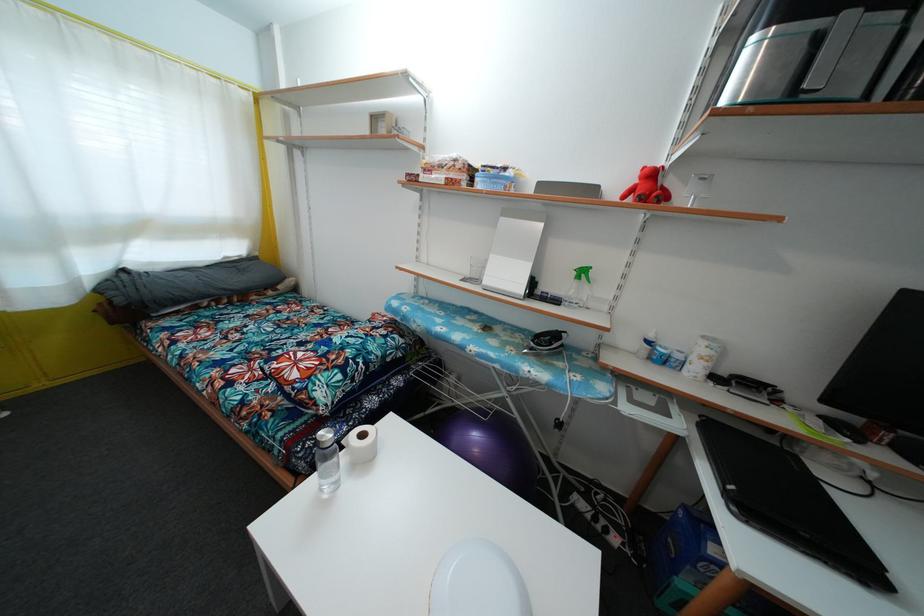
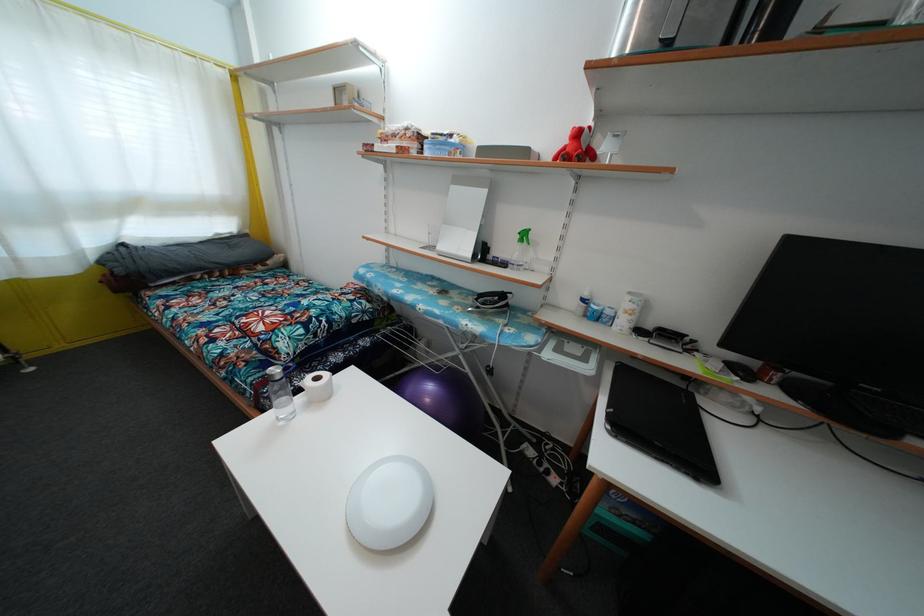
In the second image, find the point that corresponds to (726,379) in the first image.

(652, 334)